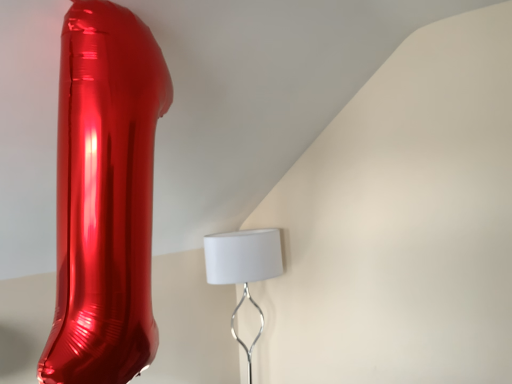
Question: Is shiny metallic balloon at left wider or thinner than white matte lampshade at center?

Choices:
 (A) wide
 (B) thin

Answer: (B)

Question: Choose the correct answer: Is shiny metallic balloon at left inside white matte lampshade at center or outside it?

Choices:
 (A) inside
 (B) outside

Answer: (B)

Question: From the image's perspective, is shiny metallic balloon at left positioned above or below white matte lampshade at center?

Choices:
 (A) below
 (B) above

Answer: (B)

Question: From a real-world perspective, is white matte lampshade at center above or below shiny metallic balloon at left?

Choices:
 (A) below
 (B) above

Answer: (A)

Question: In terms of width, does white matte lampshade at center look wider or thinner when compared to shiny metallic balloon at left?

Choices:
 (A) wide
 (B) thin

Answer: (A)

Question: Based on their positions, is white matte lampshade at center located to the left or right of shiny metallic balloon at left?

Choices:
 (A) left
 (B) right

Answer: (B)

Question: From their relative heights in the image, would you say white matte lampshade at center is taller or shorter than shiny metallic balloon at left?

Choices:
 (A) tall
 (B) short

Answer: (B)